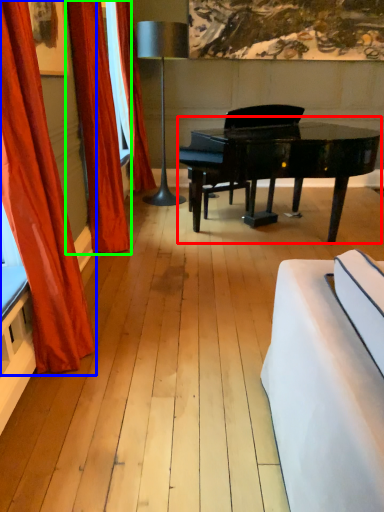
Question: Considering the real-world distances, which object is farthest from piano (highlighted by a red box)? curtain (highlighted by a blue box) or curtain (highlighted by a green box)?

Choices:
 (A) curtain
 (B) curtain

Answer: (A)